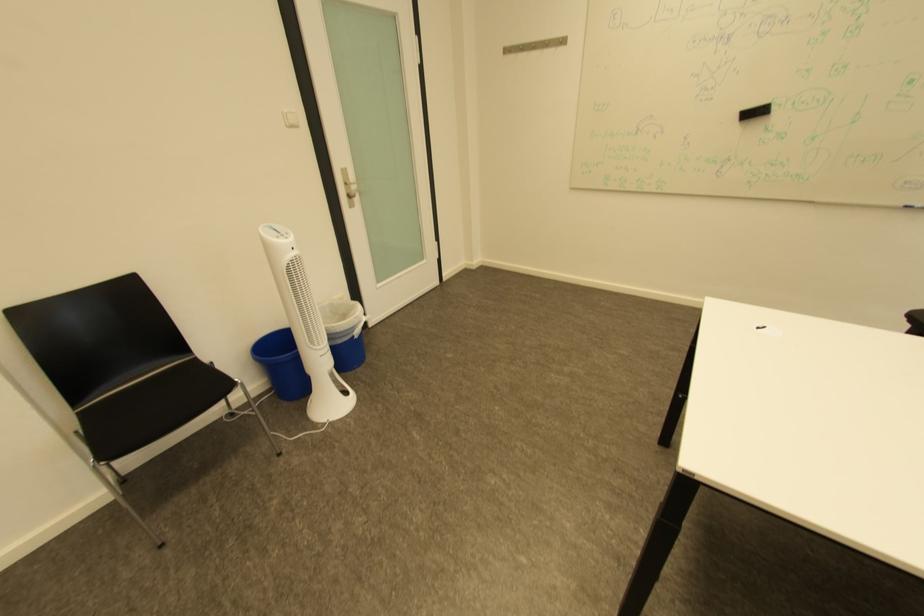
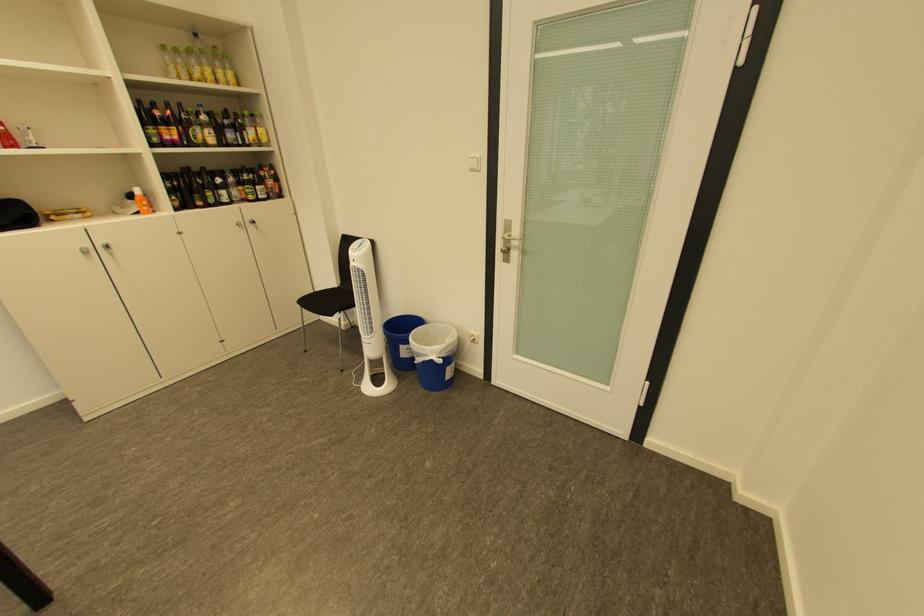
The point at (362, 330) is marked in the first image. Where is the corresponding point in the second image?

(429, 355)